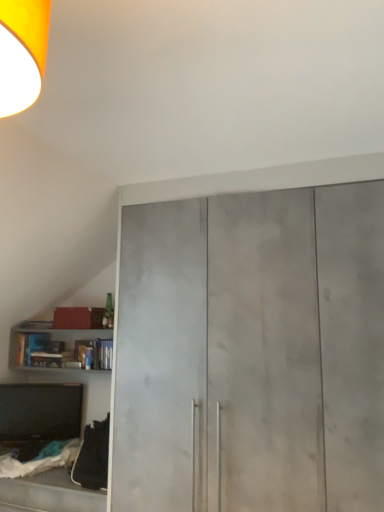
Question: From a real-world perspective, is matte concrete cupboard at center above or below matte gray bookshelf at lower left?

Choices:
 (A) above
 (B) below

Answer: (B)

Question: Relative to matte gray bookshelf at lower left, is matte concrete cupboard at center in front or behind?

Choices:
 (A) front
 (B) behind

Answer: (A)

Question: Considering the relative positions of matte concrete cupboard at center and matte gray bookshelf at lower left in the image provided, is matte concrete cupboard at center to the left or to the right of matte gray bookshelf at lower left?

Choices:
 (A) left
 (B) right

Answer: (B)

Question: Relative to matte concrete cupboard at center, is matte gray bookshelf at lower left in front or behind?

Choices:
 (A) front
 (B) behind

Answer: (B)

Question: From the image's perspective, is matte gray bookshelf at lower left located above or below matte concrete cupboard at center?

Choices:
 (A) above
 (B) below

Answer: (B)

Question: Is point (51, 356) closer or farther from the camera than point (329, 161)?

Choices:
 (A) farther
 (B) closer

Answer: (A)

Question: Looking at their shapes, would you say matte gray bookshelf at lower left is wider or thinner than matte concrete cupboard at center?

Choices:
 (A) thin
 (B) wide

Answer: (A)